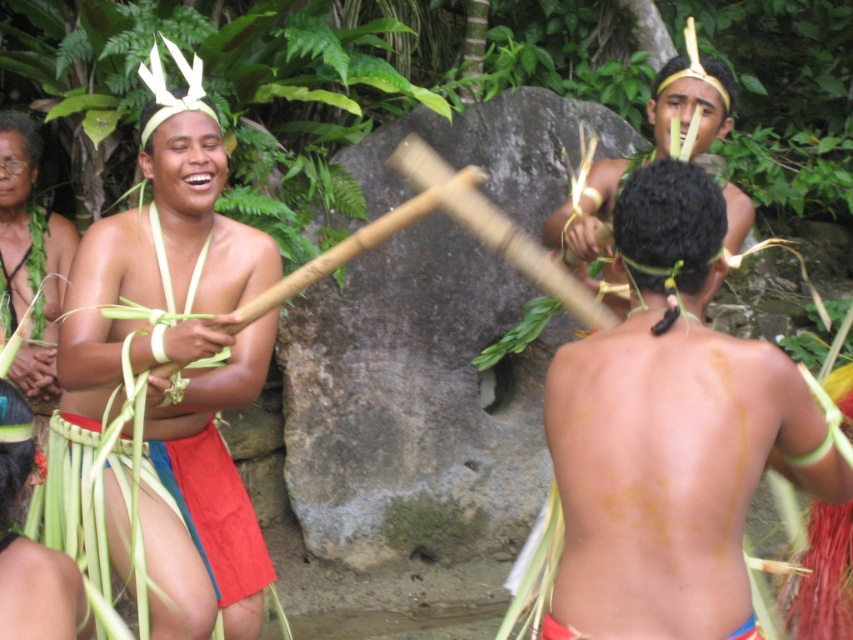
You are a photographer capturing the scene of the traditional dance. You notice the smooth skin at center and the smooth brown wooden stick at center. Which object is closer to the camera?

The smooth brown wooden stick at center is closer to the camera because the smooth skin at center is positioned under it, meaning the stick is in front.

Based on the scene description, can you determine which object is taller between the smooth skin at center and the smooth brown wooden stick at center?

The smooth skin at center is much taller than the smooth brown wooden stick at center according to the description.